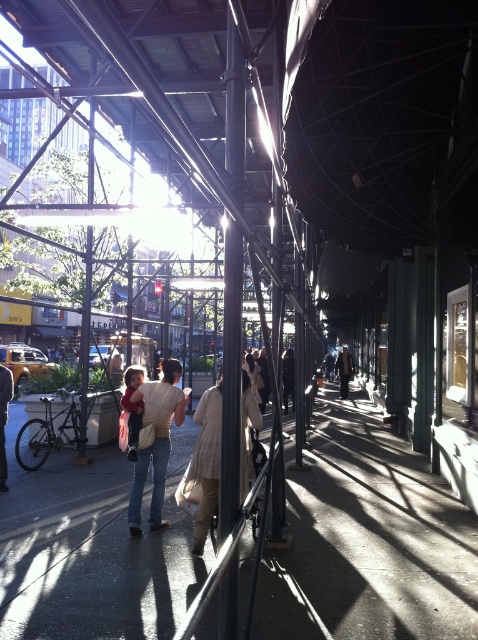
Question: Which of the following is the farthest from the observer?

Choices:
 (A) denim jacket at center
 (B) concrete sidewalk at center

Answer: (A)

Question: Is beige textured coat at center wider than denim jacket at center?

Choices:
 (A) no
 (B) yes

Answer: (A)

Question: Does beige textured coat at center appear over denim jacket at center?

Choices:
 (A) yes
 (B) no

Answer: (A)

Question: Does concrete sidewalk at center have a lesser width compared to beige textured coat at center?

Choices:
 (A) yes
 (B) no

Answer: (B)

Question: Estimate the real-world distances between objects in this image. Which object is farther from the denim jacket at center?

Choices:
 (A) beige textured coat at center
 (B) concrete sidewalk at center

Answer: (B)

Question: Estimate the real-world distances between objects in this image. Which object is farther from the denim jacket at center?

Choices:
 (A) beige textured coat at center
 (B) concrete sidewalk at center

Answer: (B)